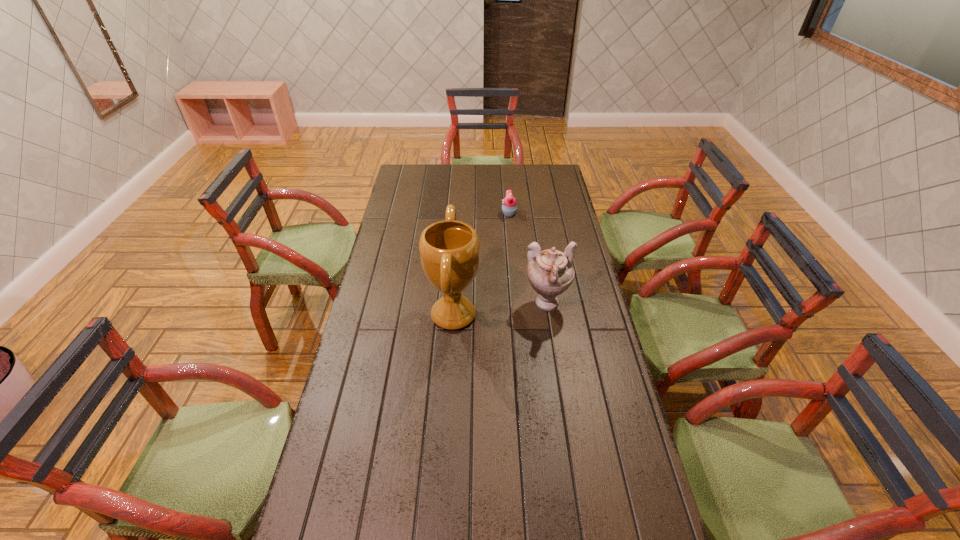
Where is `object that is positioned at the right edge`? object that is positioned at the right edge is located at coordinates (550, 272).

The height and width of the screenshot is (540, 960). What are the coordinates of `free location at the far edge of the desktop` in the screenshot? It's located at (485, 172).

This screenshot has height=540, width=960. Find the location of `free space at the left edge`. free space at the left edge is located at coordinates (375, 450).

Find the location of a particular element. vacant space at the right edge of the desktop is located at coordinates (594, 308).

Locate an element on the screen. The image size is (960, 540). vacant area at the far right corner of the desktop is located at coordinates (551, 188).

Where is `vacant point located between the leftmost object and the urn`? vacant point located between the leftmost object and the urn is located at coordinates [x=500, y=310].

Locate an element on the screen. This screenshot has height=540, width=960. empty location between the urn and the leftmost object is located at coordinates (500, 310).

Where is `empty location between the tallest object and the shortest object`? This screenshot has width=960, height=540. empty location between the tallest object and the shortest object is located at coordinates (481, 264).

Locate an element on the screen. Image resolution: width=960 pixels, height=540 pixels. free space between the urn and the leftmost object is located at coordinates (500, 310).

Locate which object is the closest to the cupcake. Please provide its 2D coordinates. Your answer should be formatted as a tuple, i.e. [(x, y)], where the tuple contains the x and y coordinates of a point satisfying the conditions above.

[(449, 250)]